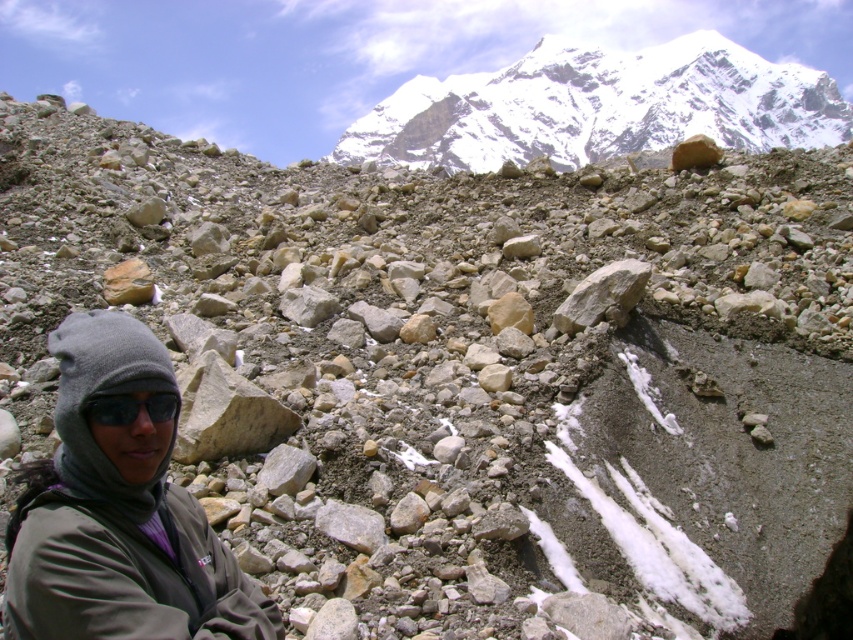
In the scene shown: You are a hiker preparing to climb the mountain. You spot a gray fleece jacket at lower left and black matte goggles at lower left. Which item should you pick up first if you want to grab the larger item first?

The gray fleece jacket at lower left is bigger than the black matte goggles at lower left, so you should pick up the gray fleece jacket at lower left first.

You are a hiker planning to climb the snowy granite peak at upper center and notice the gray fleece jacket at lower left on the path. Which object is positioned more to the east if the peak is facing north?

The gray fleece jacket at lower left is positioned more to the east since it is to the left of the snowy granite peak at upper center, and if the peak faces north, left would correspond to the east direction.